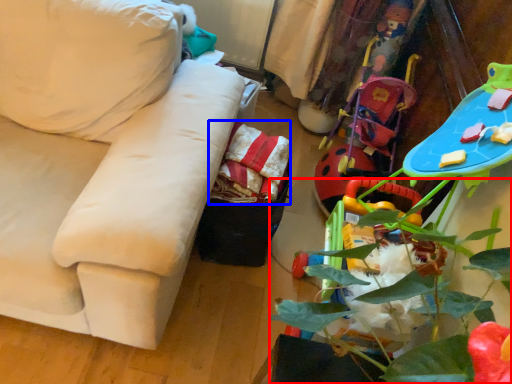
Question: Which of the following is the farthest to the observer, plant (highlighted by a red box) or material (highlighted by a blue box)?

Choices:
 (A) plant
 (B) material

Answer: (B)